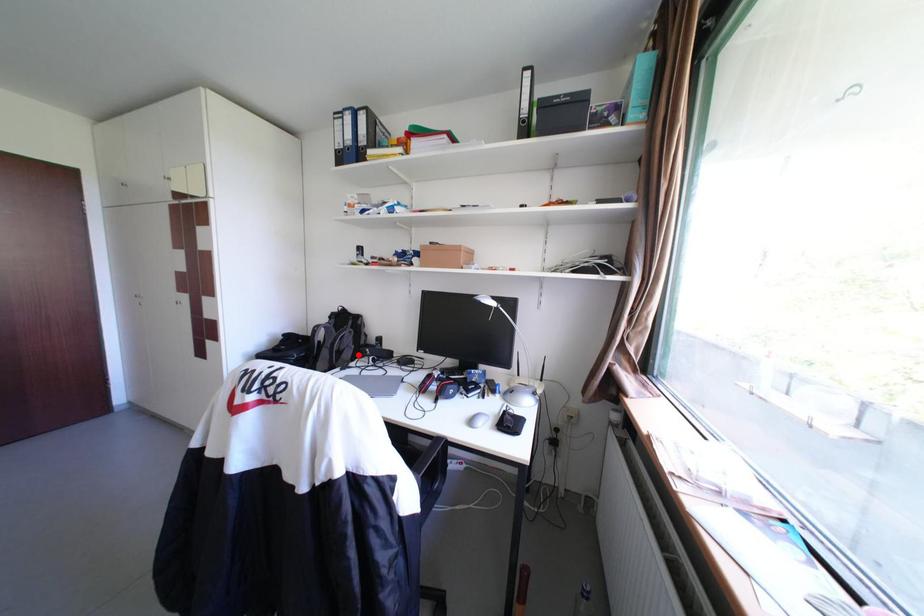
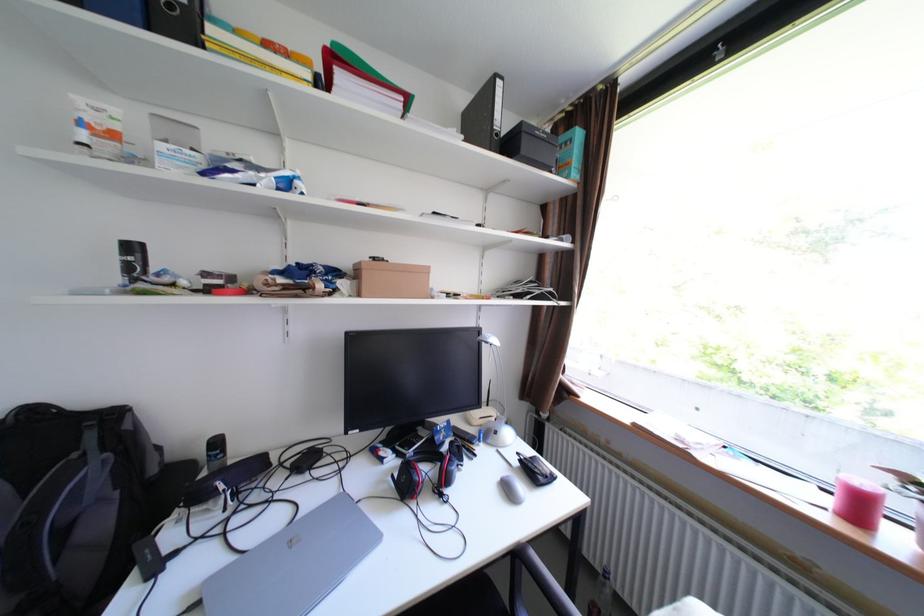
Question: I am providing you with two images of the same scene from different viewpoints. Given a red point in image1, look at the same physical point in image2. Is it:

Choices:
 (A) Closer to the viewpoint
 (B) Farther from the viewpoint

Answer: (A)